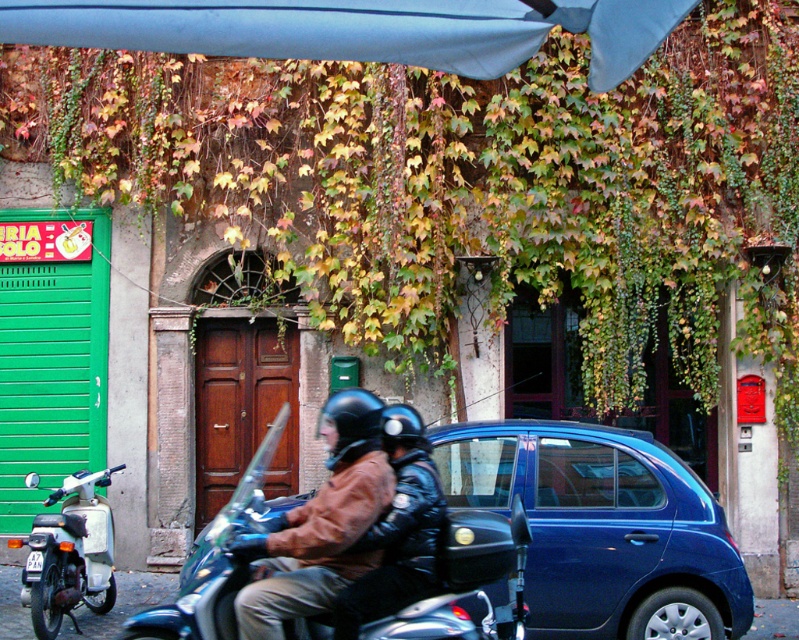
Question: Which point is closer to the camera?

Choices:
 (A) (86, 481)
 (B) (690, 573)
 (C) (400, 500)
 (D) (257, 477)

Answer: (C)

Question: Which of the following is the farthest from the observer?

Choices:
 (A) (350, 452)
 (B) (406, 433)
 (C) (495, 52)

Answer: (B)

Question: In this image, where is blue fabric umbrella at upper center located relative to leather jacket at center?

Choices:
 (A) left
 (B) right

Answer: (A)

Question: Is shiny chrome scooter at center bigger than metallic silver scooter at lower left?

Choices:
 (A) yes
 (B) no

Answer: (A)

Question: Estimate the real-world distances between objects in this image. Which object is closer to the metallic silver scooter at lower left?

Choices:
 (A) white plastic license plate at center
 (B) leather jacket at center
 (C) matte black helmet at center
 (D) blue fabric umbrella at upper center

Answer: (A)

Question: Is the position of blue fabric umbrella at upper center less distant than that of leather jacket at center?

Choices:
 (A) yes
 (B) no

Answer: (A)